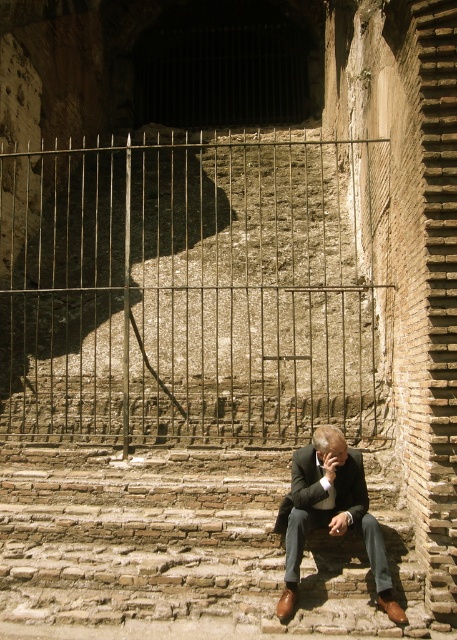
You are a visitor at this historical site and want to take a photo of the rusty metal gate at center and the dark brown leather suit at lower center together in the frame. Based on their sizes, will they both fit in the camera view if the gate is placed on the left side of the frame?

The rusty metal gate at center might be wider than dark brown leather suit at lower center, so positioning the gate on the left side of the frame may require adjusting the camera angle to ensure both objects fit within the view.